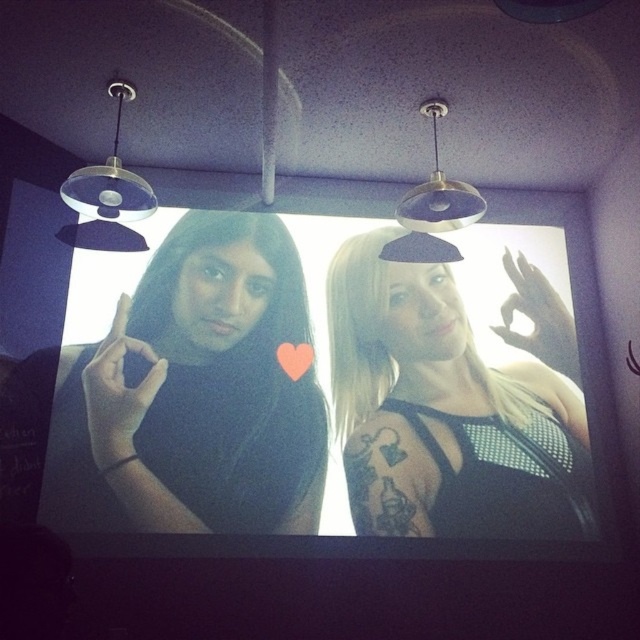
Looking at this image, is black matte shirt at left smaller than black mesh top at center?

No, black matte shirt at left is not smaller than black mesh top at center.

The height and width of the screenshot is (640, 640). What are the coordinates of `black matte shirt at left` in the screenshot? It's located at (195, 394).

This screenshot has width=640, height=640. In order to click on black matte shirt at left in this screenshot , I will do `click(195, 394)`.